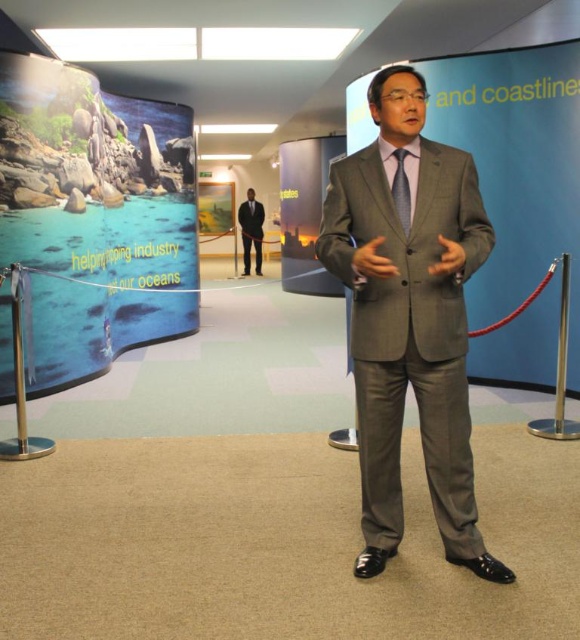
You are an event planner arranging a photoshoot in the described scene. You need to ensure that the black suit at center and the dark gray silk tie at center are visible in the final shot. Given their positions, which object is more likely to be fully visible in the photo?

The black suit at center is positioned over the dark gray silk tie at center, so the black suit at center is more likely to be fully visible in the photo.

You are standing in the exhibition space and want to place a small decorative item exactly halfway between the two points, point (393, 81) and point (256, 253). Given that the points are on a flat surface, will the midpoint be closer to the man in the gray suit or further away from him?

The midpoint between point (393, 81) and point (256, 253) will be closer to the man in the gray suit because point (393, 81) is closer to the viewer than point (256, 253). Since the man is in the foreground, the midpoint would still be positioned closer to him compared to the background panels.

You are an event organizer and need to arrange two speakers based on their attire. The first speaker is wearing the gray wool suit at center, and the second speaker is wearing the black suit at center. According to the scene, which speaker is positioned to the right of the other?

The gray wool suit at center is to the right of the black suit at center, so the first speaker wearing the gray wool suit at center is positioned to the right of the second speaker in the black suit at center.